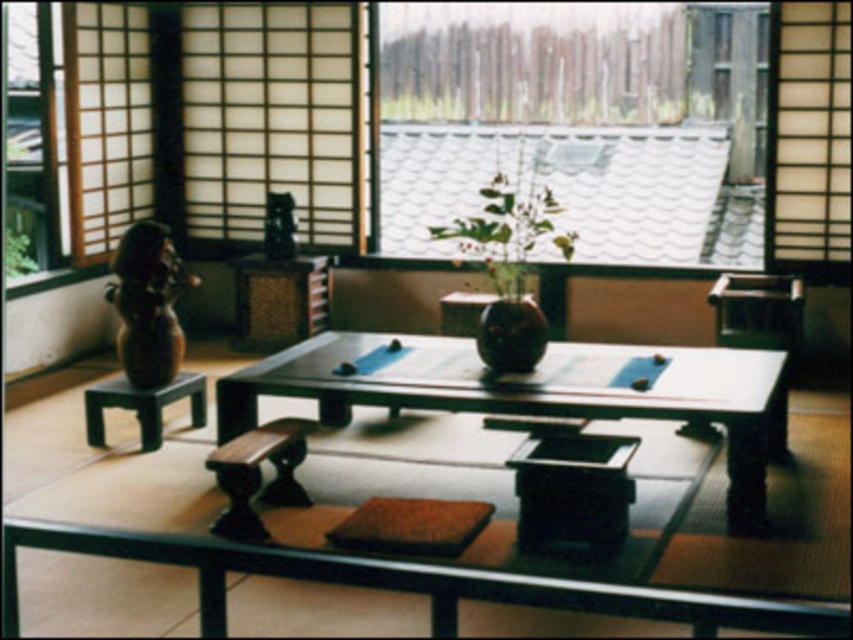
You are standing in the Japanese room and want to place a small object on the table. You have two points on the table marked as point (273, 90) and point (546, 336). Which point is closer to you?

Point (273, 90) is closer to you because it is further to the viewer than point (546, 336).

You are standing in the Japanese room and want to know if the transparent glass window at upper center is wider than the smooth dark wood table at center. Can you confirm this?

The transparent glass window at upper center might be wider than smooth dark wood table at center.